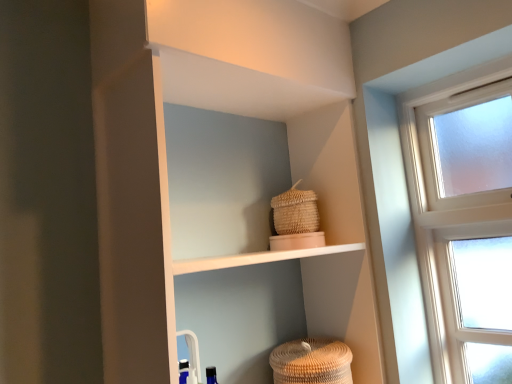
Question: Is brown woven basket at lower center, the first basket when ordered from bottom to top, aimed at white matte shelf at upper center?

Choices:
 (A) no
 (B) yes

Answer: (B)

Question: Is brown woven basket at lower center, the first basket when ordered from bottom to top, wider than white matte shelf at upper center?

Choices:
 (A) no
 (B) yes

Answer: (A)

Question: Is brown woven basket at lower center, the first basket when ordered from bottom to top, not close to white matte shelf at upper center?

Choices:
 (A) no
 (B) yes

Answer: (A)

Question: Considering the relative sizes of brown woven basket at lower center, which is counted as the 2th basket, starting from the top, and white matte shelf at upper center in the image provided, is brown woven basket at lower center, which is counted as the 2th basket, starting from the top, bigger than white matte shelf at upper center?

Choices:
 (A) yes
 (B) no

Answer: (B)

Question: Can you confirm if brown woven basket at lower center, the first basket when ordered from bottom to top, is thinner than white matte shelf at upper center?

Choices:
 (A) yes
 (B) no

Answer: (A)

Question: Relative to brown woven basket at lower center, which is counted as the 2th basket, starting from the top, is woven straw basket at upper center, which ranks as the 2th basket in bottom-to-top order, in front or behind?

Choices:
 (A) front
 (B) behind

Answer: (B)

Question: From a real-world perspective, is woven straw basket at upper center, the first basket viewed from the top, physically located above or below brown woven basket at lower center, the first basket when ordered from bottom to top?

Choices:
 (A) below
 (B) above

Answer: (B)

Question: Looking at their shapes, would you say woven straw basket at upper center, the first basket viewed from the top, is wider or thinner than brown woven basket at lower center, which is counted as the 2th basket, starting from the top?

Choices:
 (A) thin
 (B) wide

Answer: (A)

Question: Considering the relative positions of woven straw basket at upper center, the first basket viewed from the top, and brown woven basket at lower center, the first basket when ordered from bottom to top, in the image provided, is woven straw basket at upper center, the first basket viewed from the top, to the left or to the right of brown woven basket at lower center, the first basket when ordered from bottom to top,?

Choices:
 (A) right
 (B) left

Answer: (B)

Question: In terms of width, does white matte shelf at upper center look wider or thinner when compared to brown woven basket at lower center, the first basket when ordered from bottom to top?

Choices:
 (A) thin
 (B) wide

Answer: (B)

Question: Is white matte shelf at upper center inside the boundaries of brown woven basket at lower center, the first basket when ordered from bottom to top, or outside?

Choices:
 (A) inside
 (B) outside

Answer: (B)

Question: Is point (287, 3) closer or farther from the camera than point (323, 380)?

Choices:
 (A) closer
 (B) farther

Answer: (B)

Question: Would you say white matte shelf at upper center is to the left or to the right of brown woven basket at lower center, the first basket when ordered from bottom to top, in the picture?

Choices:
 (A) right
 (B) left

Answer: (B)

Question: Would you say brown woven basket at lower center, which is counted as the 2th basket, starting from the top, is to the left or to the right of woven straw basket at upper center, the first basket viewed from the top, in the picture?

Choices:
 (A) left
 (B) right

Answer: (B)

Question: Is brown woven basket at lower center, which is counted as the 2th basket, starting from the top, wider or thinner than woven straw basket at upper center, the first basket viewed from the top?

Choices:
 (A) thin
 (B) wide

Answer: (B)